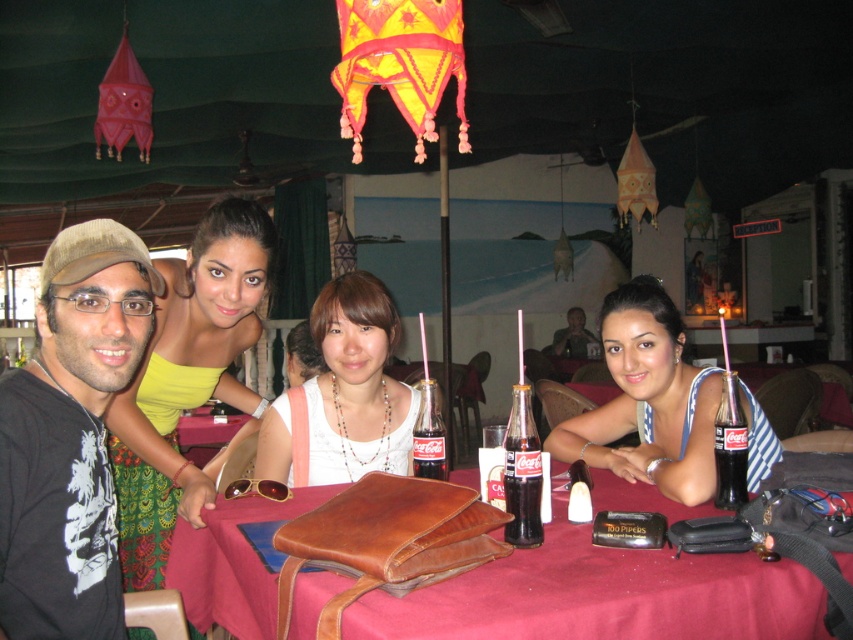
You are a waiter at the restaurant and need to deliver a drink to the customer. The customer is sitting near the brown leather bag at center and the black cotton shirt at left. Which object should you approach first to reach the customer?

The brown leather bag at center is closer to the viewer than the black cotton shirt at left, so you should approach the brown leather bag at center first to reach the customer.